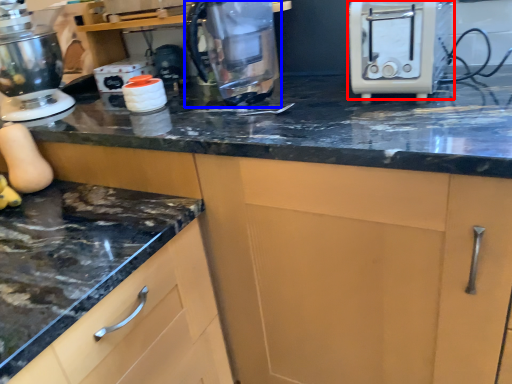
Question: Which object appears closest to the camera in this image, toaster (highlighted by a red box) or kitchen appliance (highlighted by a blue box)?

Choices:
 (A) toaster
 (B) kitchen appliance

Answer: (A)